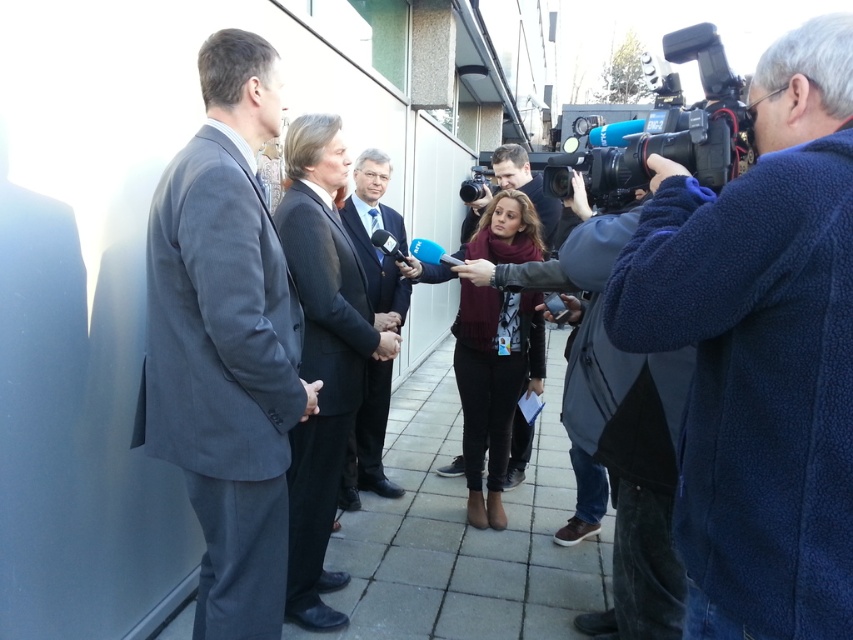
Is black plastic video camera at upper right above knitted sweater at center?

Indeed, black plastic video camera at upper right is positioned over knitted sweater at center.

Which is below, black plastic video camera at upper right or knitted sweater at center?

knitted sweater at center is lower down.

Identify the location of black plastic video camera at upper right. This screenshot has width=853, height=640. click(664, 128).

Which of these two, black plastic video camera at upper right or dark blue woolen suit at center, stands taller?

Standing taller between the two is black plastic video camera at upper right.

Which is more to the left, black plastic video camera at upper right or dark blue woolen suit at center?

From the viewer's perspective, dark blue woolen suit at center appears more on the left side.

Does point (735, 148) come farther from viewer compared to point (347, 234)?

That is False.

Find the location of a particular element. Image resolution: width=853 pixels, height=640 pixels. black plastic video camera at upper right is located at coordinates (664, 128).

Between point (401, 493) and point (503, 173), which one is positioned behind?

Point (503, 173)

Which is above, dark blue woolen suit at center or knitted sweater at center?

Positioned higher is knitted sweater at center.

The height and width of the screenshot is (640, 853). I want to click on dark blue woolen suit at center, so tap(378, 257).

Locate an element on the screen. The height and width of the screenshot is (640, 853). dark blue woolen suit at center is located at coordinates (378, 257).